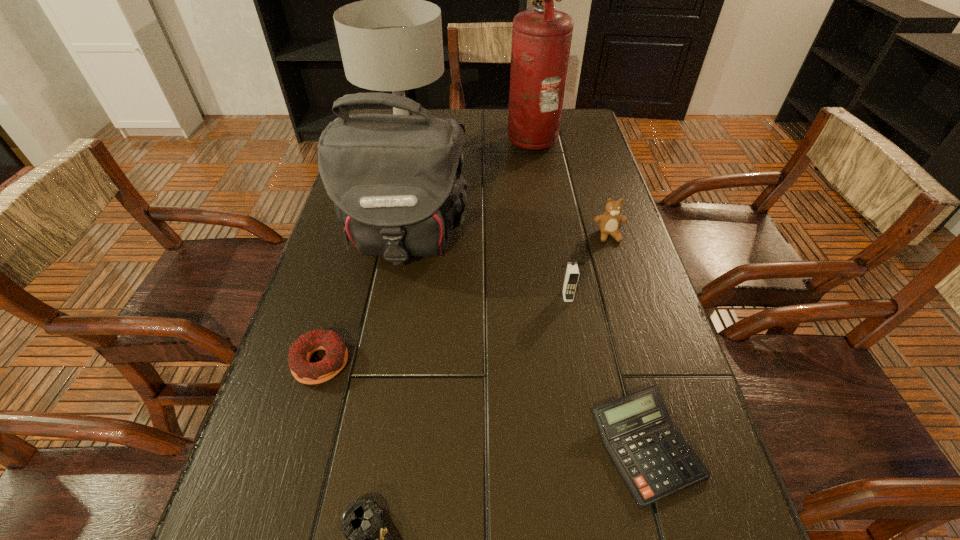
Where is `fire extinguisher`? This screenshot has height=540, width=960. fire extinguisher is located at coordinates (541, 37).

Find the location of a particular element. The width and height of the screenshot is (960, 540). lampshade is located at coordinates (392, 40).

Image resolution: width=960 pixels, height=540 pixels. I want to click on shoulder bag, so click(x=396, y=181).

Locate an element on the screen. The image size is (960, 540). the fifth shortest object is located at coordinates pyautogui.click(x=572, y=273).

Identify the location of cellular telephone. (572, 273).

Identify the location of teddy bear. The image size is (960, 540). (609, 222).

You are a GUI agent. You are given a task and a screenshot of the screen. Output one action in this format:
    pyautogui.click(x=<x>, y=<y>)
    Task: Click on the sixth farthest object
    The image size is (960, 540).
    Given the screenshot: What is the action you would take?
    pyautogui.click(x=301, y=351)

The width and height of the screenshot is (960, 540). What are the coordinates of `calculator` in the screenshot? It's located at (653, 459).

Find the location of a particular element. free space located at the front of the tallest object where the nozzle is aimed is located at coordinates (429, 138).

Locate an element on the screen. The image size is (960, 540). free region located at the front of the tallest object where the nozzle is aimed is located at coordinates (442, 138).